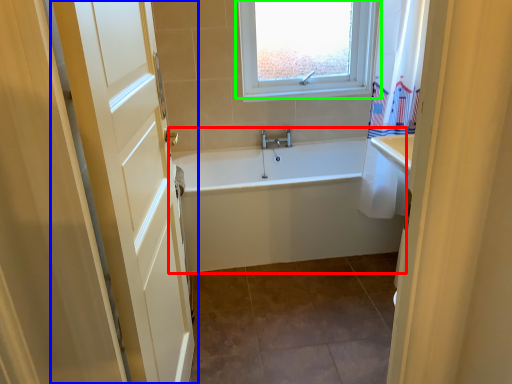
Question: Considering the real-world distances, which object is closest to bathtub (highlighted by a red box)? door (highlighted by a blue box) or window (highlighted by a green box).

Choices:
 (A) door
 (B) window

Answer: (A)